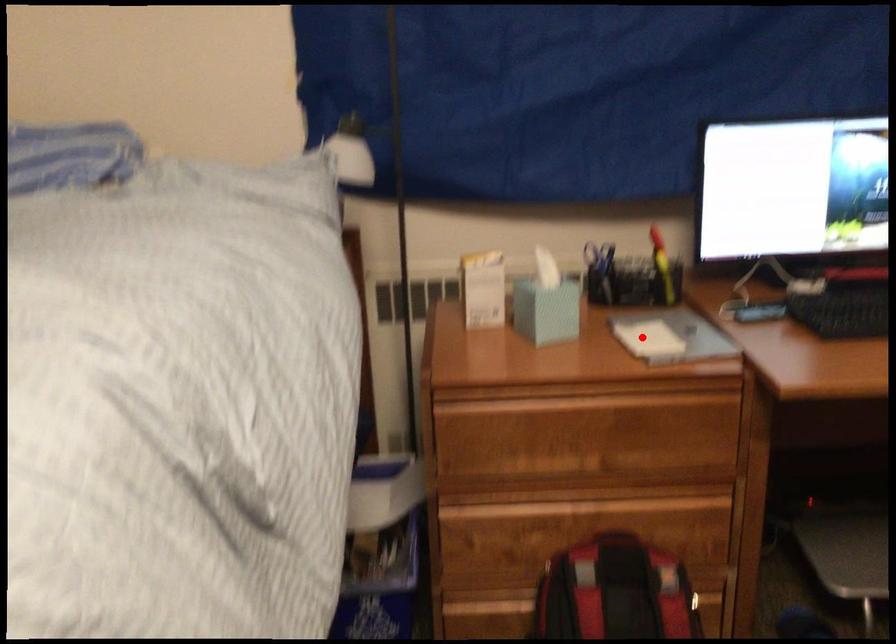
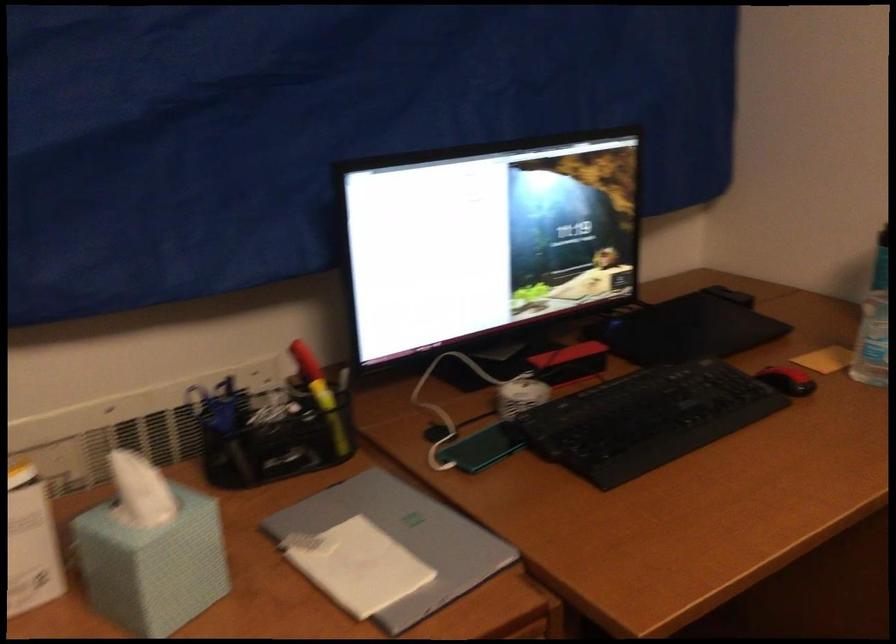
Question: I am providing you with two images of the same scene from different viewpoints. A red point is marked on the first image. At the location where the point appears in image 1, is it still visible in image 2?

Choices:
 (A) Yes
 (B) No

Answer: (A)